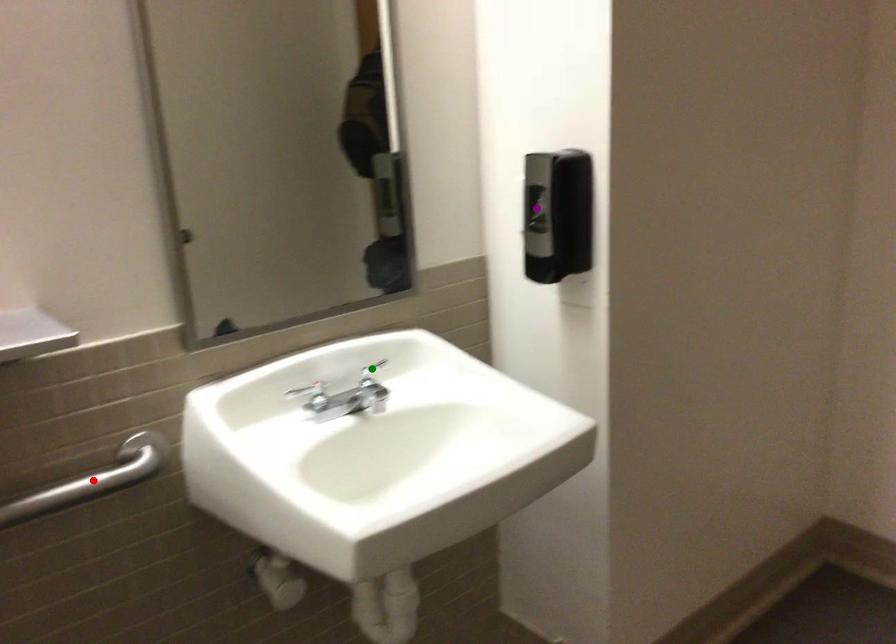
Order these from farthest to nearest:
A) red point
B) purple point
C) green point

green point
purple point
red point